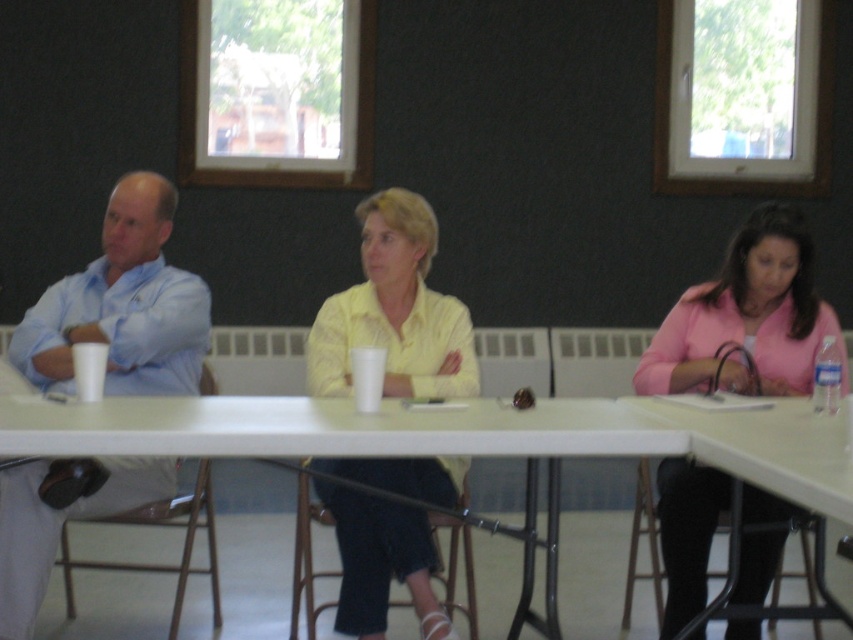
Question: Which of the following is the closest to the observer?

Choices:
 (A) light blue shirt at left
 (B) pink matte jacket at lower right
 (C) white plastic table at center
 (D) yellow matte shirt at center

Answer: (C)

Question: Where is yellow matte shirt at center located in relation to light blue shirt at left in the image?

Choices:
 (A) right
 (B) left

Answer: (A)

Question: Estimate the real-world distances between objects in this image. Which object is closer to the pink matte jacket at lower right?

Choices:
 (A) white plastic table at center
 (B) yellow matte shirt at center

Answer: (A)

Question: Which of the following is the farthest from the observer?

Choices:
 (A) (32, 499)
 (B) (550, 422)
 (C) (746, 253)
 (D) (451, 637)

Answer: (C)

Question: Is pink matte jacket at lower right below white plastic table at center?

Choices:
 (A) no
 (B) yes

Answer: (A)

Question: Can you confirm if yellow matte shirt at center is smaller than white plastic table at center?

Choices:
 (A) no
 (B) yes

Answer: (A)